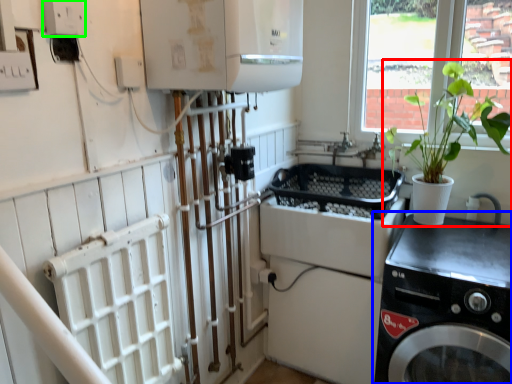
Question: Which object is positioned farthest from houseplant (highlighted by a red box)? Select from washing machine (highlighted by a blue box) and electric outlet (highlighted by a green box).

Choices:
 (A) washing machine
 (B) electric outlet

Answer: (B)